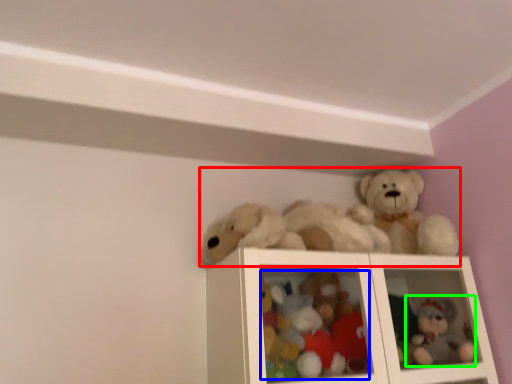
Question: Which object is the farthest from toy (highlighted by a red box)? Choose among these: toy (highlighted by a blue box) or toy (highlighted by a green box).

Choices:
 (A) toy
 (B) toy

Answer: (B)